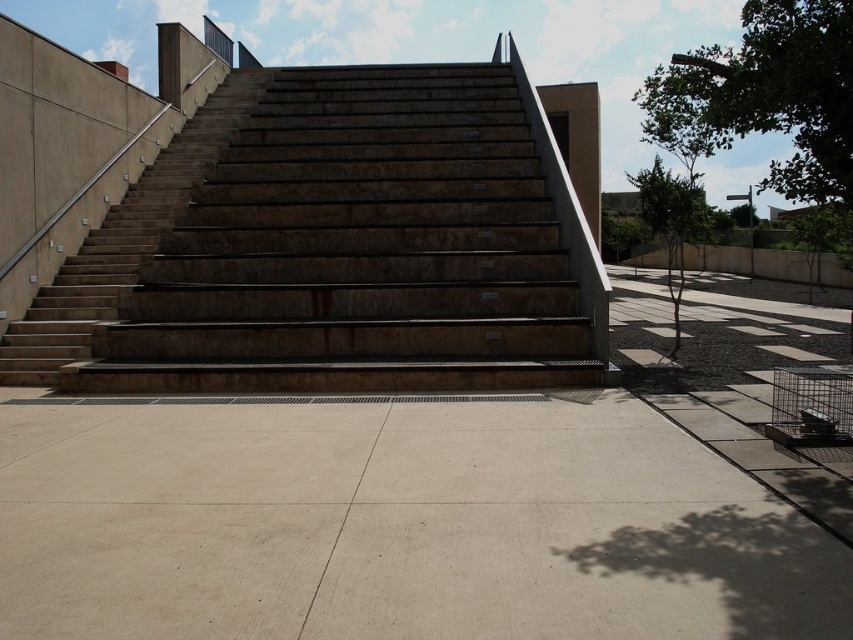
Question: Which point appears farthest from the camera in this image?

Choices:
 (A) (721, 628)
 (B) (509, 324)

Answer: (B)

Question: Can you confirm if beige concrete pavement at center is positioned below brown stone stairs at center?

Choices:
 (A) no
 (B) yes

Answer: (B)

Question: Which object appears farthest from the camera in this image?

Choices:
 (A) beige concrete pavement at center
 (B) brown stone stairs at center

Answer: (B)

Question: Can you confirm if beige concrete pavement at center is positioned below brown stone stairs at center?

Choices:
 (A) no
 (B) yes

Answer: (B)

Question: Which object is farther from the camera taking this photo?

Choices:
 (A) beige concrete pavement at center
 (B) brown stone stairs at center

Answer: (B)

Question: Observing the image, what is the correct spatial positioning of beige concrete pavement at center in reference to brown stone stairs at center?

Choices:
 (A) left
 (B) right

Answer: (B)